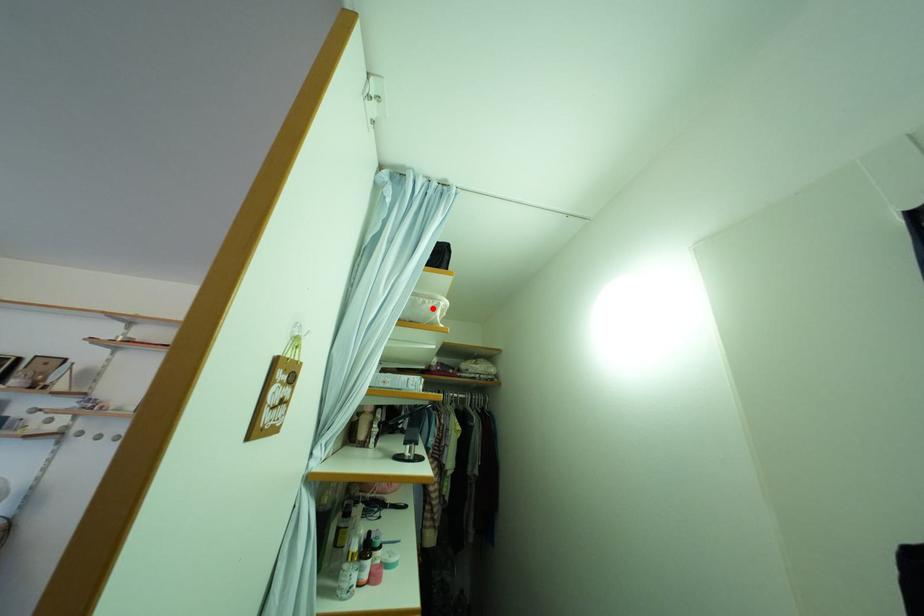
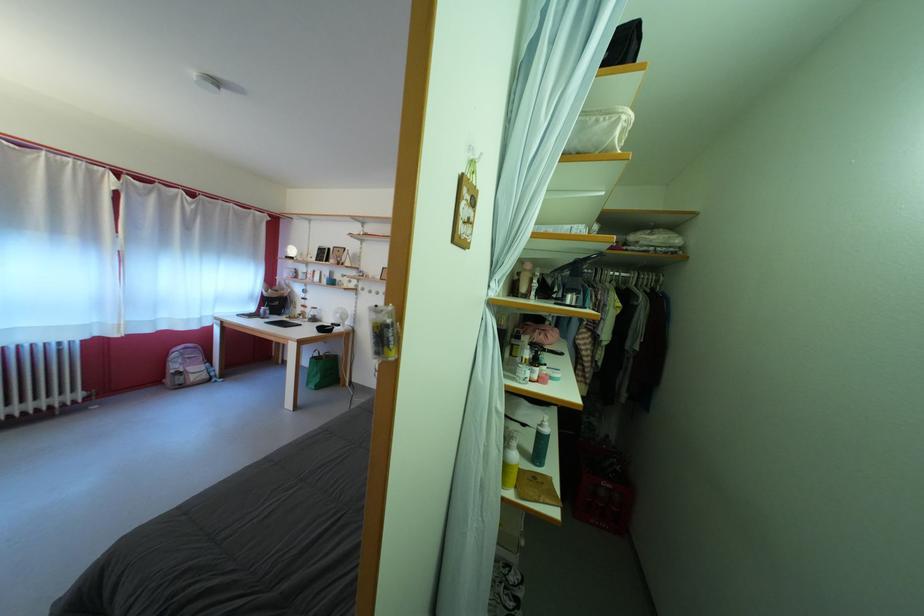
Locate, in the second image, the point that corresponds to the highlighted location in the first image.

(605, 128)